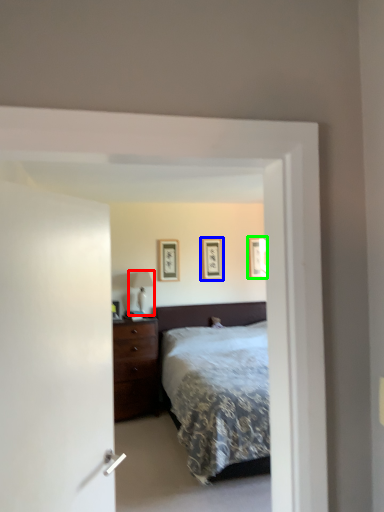
Question: Based on their relative distances, which object is farther from table lamp (highlighted by a red box)? Choose from picture frame (highlighted by a blue box) and picture frame (highlighted by a green box).

Choices:
 (A) picture frame
 (B) picture frame

Answer: (B)